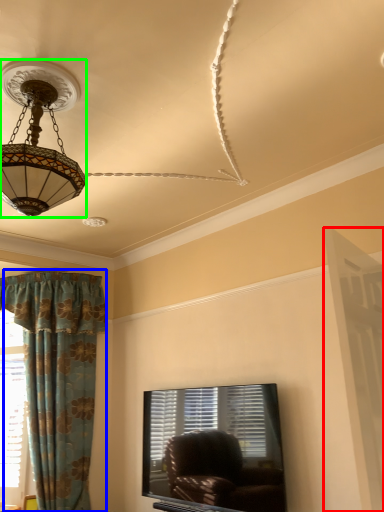
Question: Which object is the closest to the screen door (highlighted by a red box)? Choose among these: curtain (highlighted by a blue box) or lamp (highlighted by a green box).

Choices:
 (A) curtain
 (B) lamp

Answer: (B)